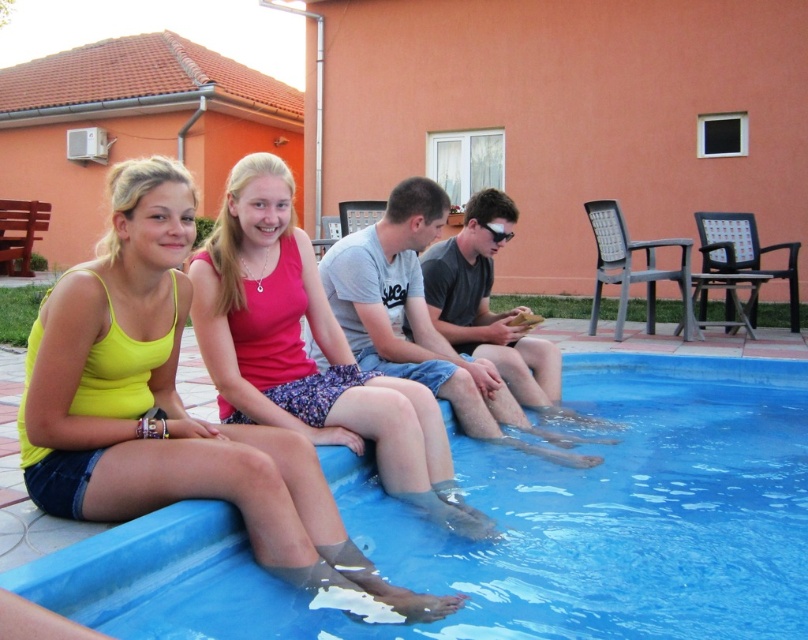
You are a photographer trying to capture a candid shot of the group. Since you want to ensure both the yellow matte tank top at upper left and the pink fabric dress at center are clearly visible in the frame, which one should you focus on first to avoid blurring? Explain your reasoning based on their positions.

You should focus on the yellow matte tank top at upper left first because it is in front of the pink fabric dress at center. By focusing on the closer object, the photographer can ensure both are in focus as the background might naturally be slightly blurred, but the foreground object will be sharp.

You are a photographer trying to capture a closeup of the transparent plastic goggles at center without including the yellow matte tank top at upper left in the frame. Given their sizes, is this possible?

The yellow matte tank top at upper left has a larger size compared to transparent plastic goggles at center, so it might be challenging to frame the goggles without including the tank top if they are positioned closely together. Adjusting the camera angle or moving closer to the goggles could help isolate them in the shot.